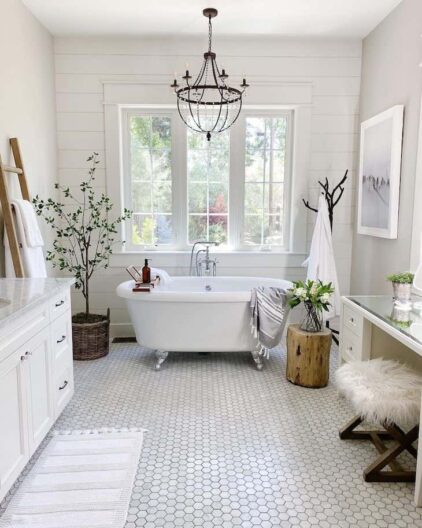
The width and height of the screenshot is (422, 528). I want to click on wooden ladder style towel rack, so click(x=23, y=174).